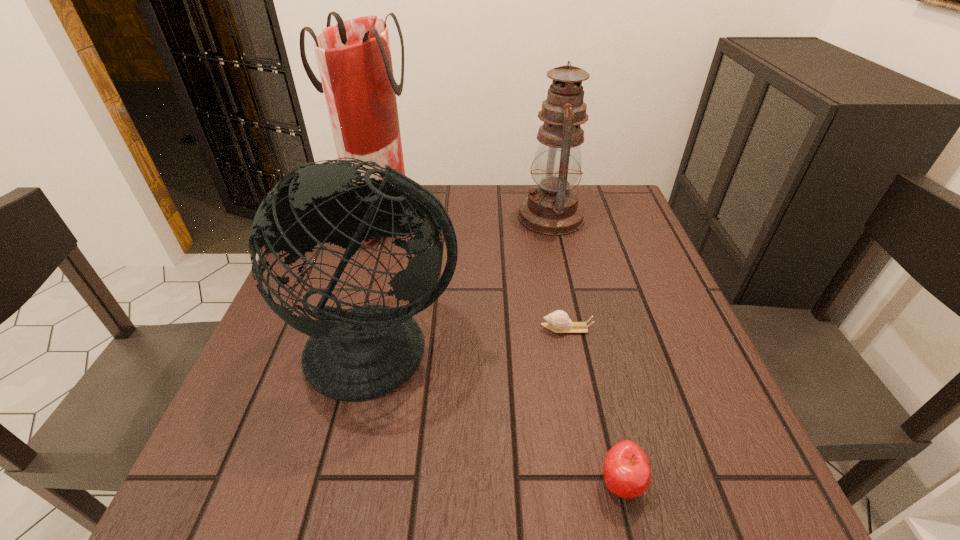
Identify the location of vacant position in the image that satisfies the following two spatial constraints: 1. on the shell of the escargot; 2. on the front-facing side of the globe. (570, 350).

Find the location of a particular element. This screenshot has height=540, width=960. vacant point that satisfies the following two spatial constraints: 1. on the shell of the escargot; 2. on the left side of the apple is located at coordinates (597, 483).

In order to click on vacant point that satisfies the following two spatial constraints: 1. on the back side of the nearest object; 2. on the shell of the shortest object in this screenshot , I will do point(584,329).